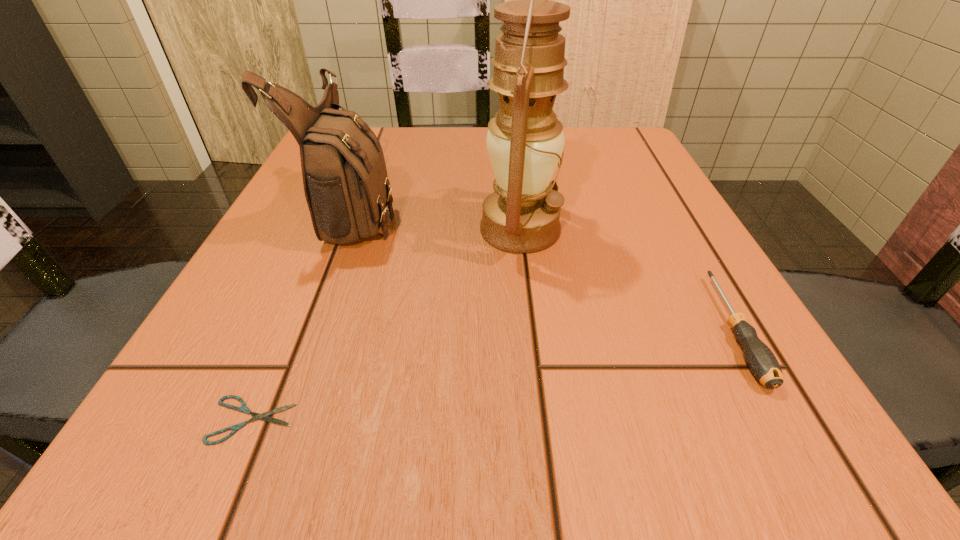
This screenshot has height=540, width=960. I want to click on vacant region at the far right corner, so click(649, 158).

You are a GUI agent. You are given a task and a screenshot of the screen. Output one action in this format:
    pyautogui.click(x=<x>, y=<y>)
    Task: Click on the vacant space at the near right corner of the desktop
    This screenshot has width=960, height=540.
    Given the screenshot: What is the action you would take?
    pyautogui.click(x=716, y=403)

I want to click on unoccupied position between the screwdriver and the nearest object, so click(492, 374).

Where is `vacant region between the tallest object and the nearest object`? vacant region between the tallest object and the nearest object is located at coordinates (386, 325).

Identify the location of unoccupied position between the tallest object and the shoulder bag. The width and height of the screenshot is (960, 540). (438, 221).

Locate an element on the screen. empty space between the second object from right to left and the shoulder bag is located at coordinates (438, 221).

You are a GUI agent. You are given a task and a screenshot of the screen. Output one action in this format:
    pyautogui.click(x=<x>, y=<y>)
    Task: Click on the unoccupied position between the second object from right to left and the shoulder bag
    Image resolution: width=960 pixels, height=540 pixels.
    Given the screenshot: What is the action you would take?
    coord(438,221)

At what (x,y) coordinates should I click in order to perform the action: click on vacant point located between the second shortest object and the shortest object. Please return your answer as a coordinate pair (x, y). Looking at the image, I should click on (492, 374).

At what (x,y) coordinates should I click in order to perform the action: click on vacant region between the third farthest object and the shears. Please return your answer as a coordinate pair (x, y). This screenshot has width=960, height=540. Looking at the image, I should click on (492, 374).

Identify the location of blank region between the shortest object and the oil lamp. This screenshot has width=960, height=540. (386, 325).